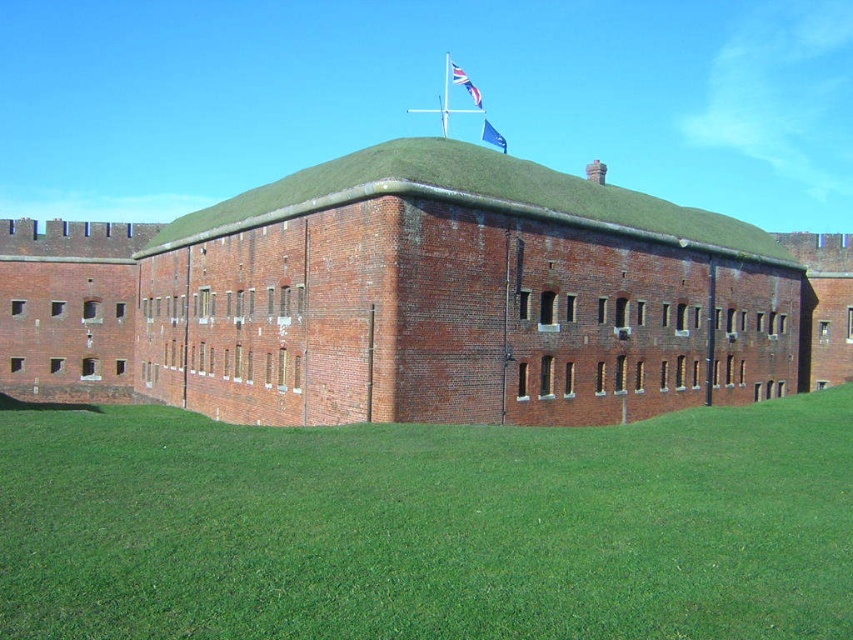
You are a maintenance worker tasked with replacing the flagpole on the roof. The flagpole is currently at the center of the blue fabric flag at center. To ensure safety, you need to know if there is enough space around the flagpole to work. Based on the scene, can you determine if the green grassy roof at center has enough space around the flagpole for safe maintenance?

The green grassy roof at center might be wider than blue fabric flag at center, so there is likely enough space around the flagpole for safe maintenance work.

You are a drone operator tasked with flying a drone to capture aerial footage of the historic brick building. The drone must stay within a 100m radius of the building to avoid restricted airspace. Given that the union jack fabric flag at upper center is located at coordinates point 0.131, 0.546, can you determine if the drone will stay within the restricted airspace if it flies directly above the flag?

The union jack fabric flag at upper center is located at coordinates point (465, 83). Since the drone must stay within a 100m radius of the building, and the flag is part of the building structure, flying directly above it would keep the drone within the restricted airspace.

You are standing outside the historic site and want to take a photo of the red brick building at center. If your camera has a maximum focus range of 100 feet, will you need to move closer to capture a clear image?

The red brick building at center is 114.23 feet away from the viewer. Since this exceeds the camera maximum focus range of 100 feet, you need to move closer to ensure the building is in focus.